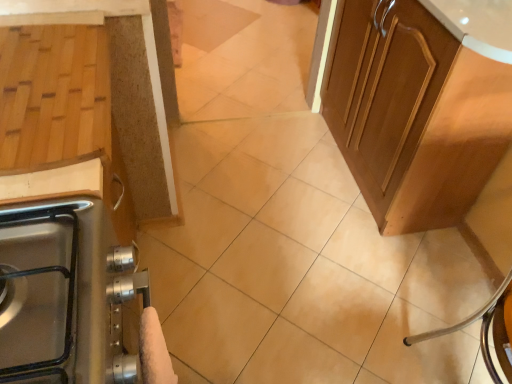
Question: Is point (151, 379) closer or farther from the camera than point (421, 210)?

Choices:
 (A) farther
 (B) closer

Answer: (B)

Question: In terms of height, does white fluffy hand towel at lower left look taller or shorter compared to glossy wood cabinet at upper right, which is counted as the first cabinetry, starting from the right?

Choices:
 (A) tall
 (B) short

Answer: (B)

Question: Which object is positioned closest to the wooden cutting board at left, the 1th cabinetry when ordered from left to right?

Choices:
 (A) glossy wood cabinet at upper right, which is counted as the first cabinetry, starting from the right
 (B) white fluffy hand towel at lower left

Answer: (B)

Question: Estimate the real-world distances between objects in this image. Which object is farther from the wooden cutting board at left, the 1th cabinetry when ordered from left to right?

Choices:
 (A) white fluffy hand towel at lower left
 (B) glossy wood cabinet at upper right, which is the 2th cabinetry in left-to-right order

Answer: (B)